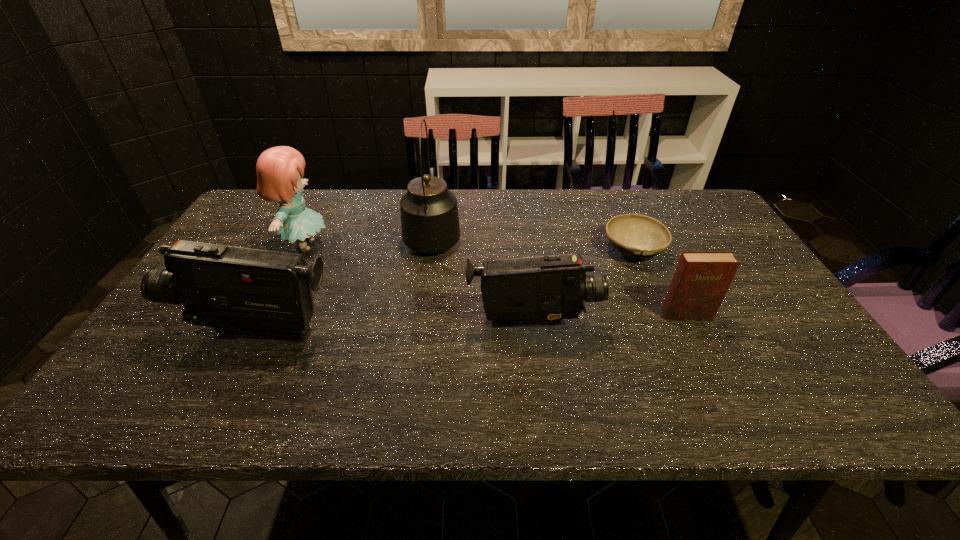
Locate an element on the screen. The width and height of the screenshot is (960, 540). object at the left edge is located at coordinates (238, 291).

Where is `object that is at the near left corner`? The height and width of the screenshot is (540, 960). object that is at the near left corner is located at coordinates (238, 291).

This screenshot has width=960, height=540. In order to click on vacant space at the far edge in this screenshot , I will do pyautogui.click(x=565, y=194).

In the image, there is a desktop. Where is `vacant region at the right edge`? The height and width of the screenshot is (540, 960). vacant region at the right edge is located at coordinates (794, 326).

In the image, there is a desktop. Identify the location of vacant space at the far right corner. This screenshot has width=960, height=540. (712, 219).

Where is `free space between the doll and the shortest object`? The height and width of the screenshot is (540, 960). free space between the doll and the shortest object is located at coordinates (469, 248).

Where is `vacant space that is in between the doll and the kettle`? The image size is (960, 540). vacant space that is in between the doll and the kettle is located at coordinates (369, 240).

Identify the location of vacant area that lies between the diary and the left camcorder. The image size is (960, 540). (472, 323).

What are the coordinates of `empty space between the right camcorder and the fifth shortest object` in the screenshot? It's located at (419, 285).

In order to click on unoccupied area between the tallest object and the fifth shortest object in this screenshot , I will do `click(369, 240)`.